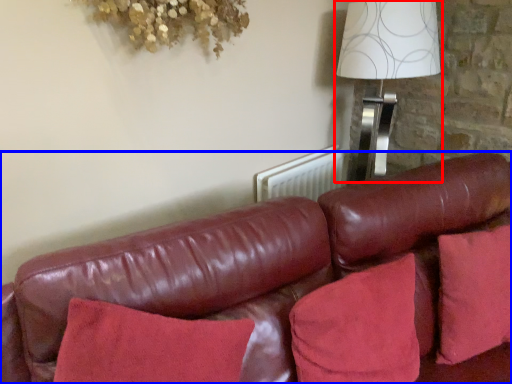
Question: Which object appears farthest to the camera in this image, table lamp (highlighted by a red box) or studio couch (highlighted by a blue box)?

Choices:
 (A) table lamp
 (B) studio couch

Answer: (A)